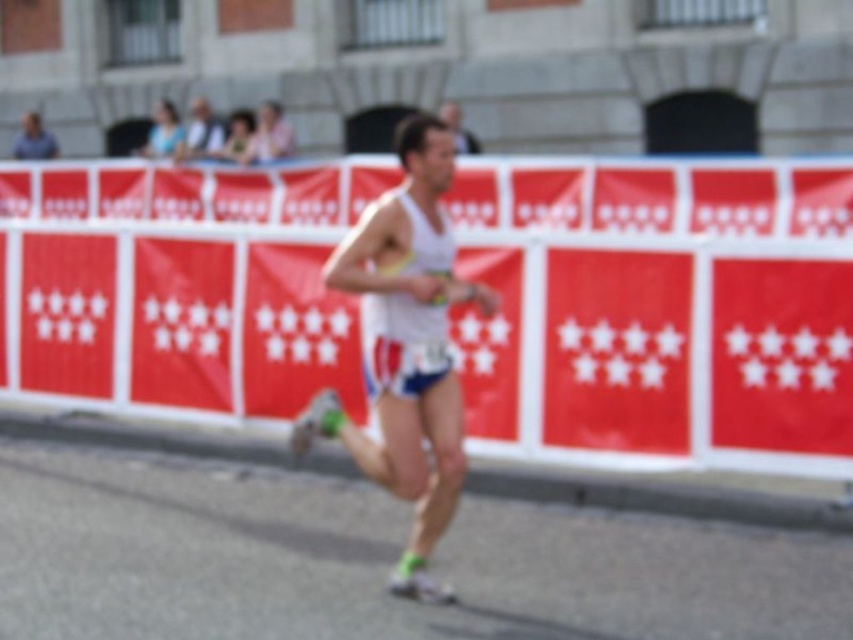
Question: Which of the following is the farthest from the observer?

Choices:
 (A) (344, 202)
 (B) (166, 125)
 (C) (444, 376)

Answer: (B)

Question: Does white fabric runner at center lie in front of matte blue tank top at upper left?

Choices:
 (A) no
 (B) yes

Answer: (B)

Question: Can you confirm if white fabric banner at center is bigger than matte blue tank top at upper left?

Choices:
 (A) yes
 (B) no

Answer: (A)

Question: Which object appears farthest from the camera in this image?

Choices:
 (A) matte blue tank top at upper left
 (B) white fabric runner at center
 (C) white fabric banner at center

Answer: (A)

Question: Does white fabric banner at center have a smaller size compared to white fabric runner at center?

Choices:
 (A) yes
 (B) no

Answer: (B)

Question: Which of the following is the farthest from the observer?

Choices:
 (A) (192, 216)
 (B) (334, 401)
 (C) (158, 147)

Answer: (C)